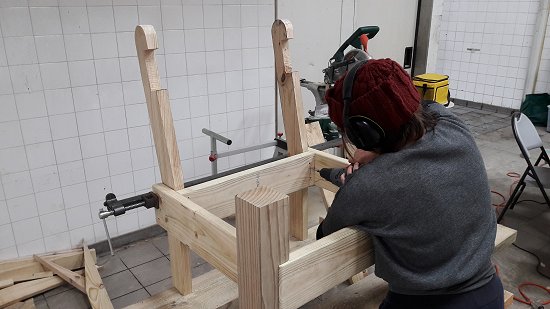
Identify the location of electrical cord. (530, 297).